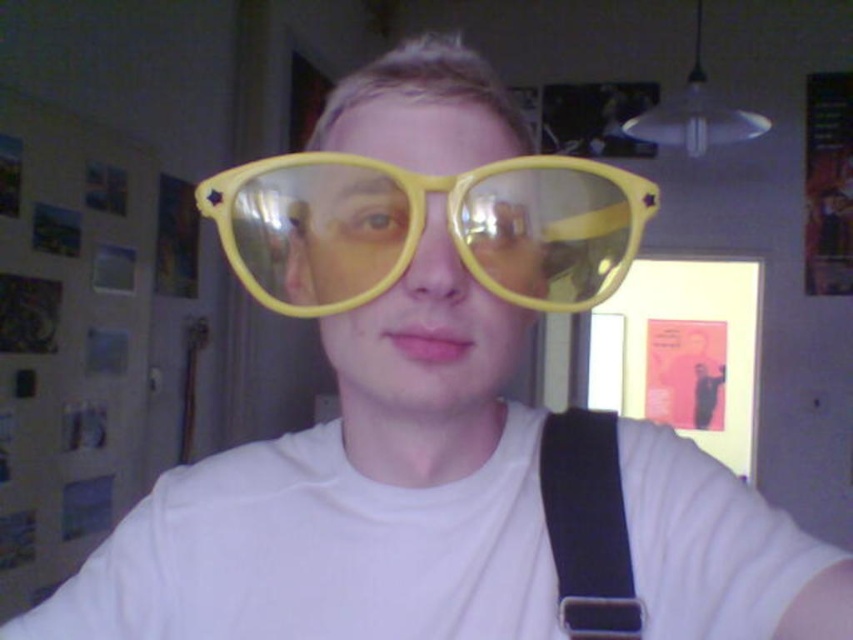
Between point (463, 228) and point (544, 429), which one is positioned behind?

Point (544, 429)

Where is `yellow plastic goggles at center`? The image size is (853, 640). yellow plastic goggles at center is located at coordinates (422, 227).

Measure the distance between point [318,259] and camera.

Point [318,259] and camera are 14.62 inches apart from each other.

Identify the location of yellow plastic goggles at center. (422, 227).